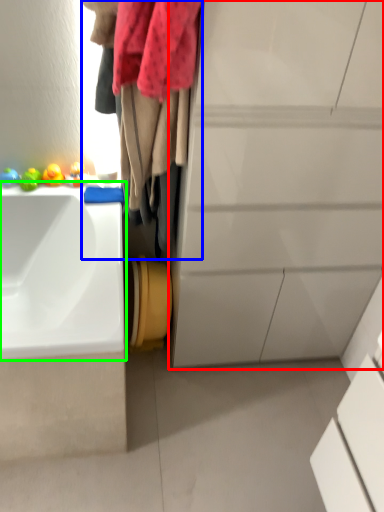
Question: Considering the real-world distances, which object is farthest from bathroom cabinet (highlighted by a red box)? laundry (highlighted by a blue box) or sink (highlighted by a green box)?

Choices:
 (A) laundry
 (B) sink

Answer: (B)